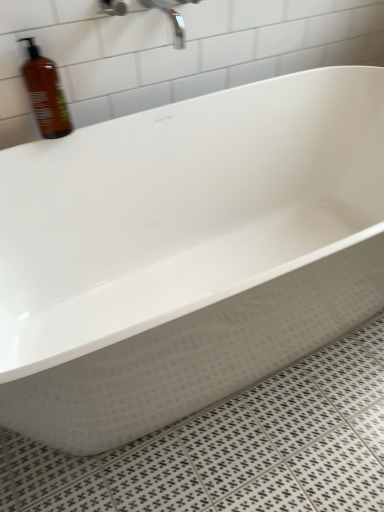
Question: From a real-world perspective, is polished chrome faucet at upper center located beneath brown matte bottle at upper left?

Choices:
 (A) yes
 (B) no

Answer: (B)

Question: From the image's perspective, is polished chrome faucet at upper center located beneath brown matte bottle at upper left?

Choices:
 (A) no
 (B) yes

Answer: (A)

Question: Can you confirm if polished chrome faucet at upper center is shorter than brown matte bottle at upper left?

Choices:
 (A) no
 (B) yes

Answer: (B)

Question: Does polished chrome faucet at upper center have a greater height compared to brown matte bottle at upper left?

Choices:
 (A) yes
 (B) no

Answer: (B)

Question: Is brown matte bottle at upper left at the back of polished chrome faucet at upper center?

Choices:
 (A) no
 (B) yes

Answer: (A)

Question: From the image's perspective, is polished chrome faucet at upper center on top of brown matte bottle at upper left?

Choices:
 (A) no
 (B) yes

Answer: (B)

Question: Is brown matte bottle at upper left outside polished chrome faucet at upper center?

Choices:
 (A) yes
 (B) no

Answer: (A)

Question: From a real-world perspective, is brown matte bottle at upper left positioned under polished chrome faucet at upper center based on gravity?

Choices:
 (A) no
 (B) yes

Answer: (B)

Question: Can you confirm if brown matte bottle at upper left is wider than polished chrome faucet at upper center?

Choices:
 (A) no
 (B) yes

Answer: (A)

Question: From the image's perspective, is brown matte bottle at upper left below polished chrome faucet at upper center?

Choices:
 (A) no
 (B) yes

Answer: (B)

Question: Is brown matte bottle at upper left positioned far away from polished chrome faucet at upper center?

Choices:
 (A) no
 (B) yes

Answer: (A)

Question: Is brown matte bottle at upper left smaller than polished chrome faucet at upper center?

Choices:
 (A) yes
 (B) no

Answer: (B)

Question: Is point (49, 96) closer or farther from the camera than point (178, 35)?

Choices:
 (A) closer
 (B) farther

Answer: (A)